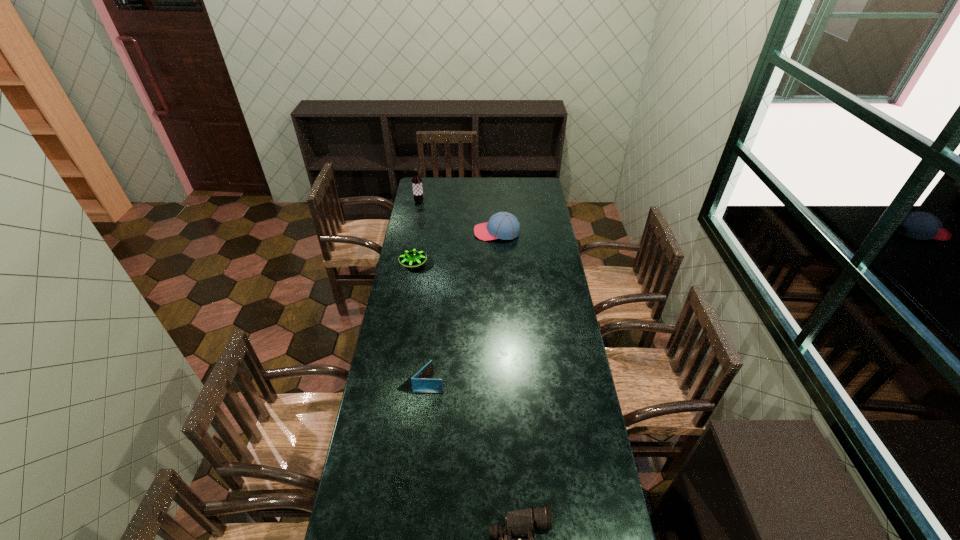
This screenshot has width=960, height=540. In order to click on blank area located 0.320m on the front-facing side of the second farthest object in this screenshot , I will do `click(417, 232)`.

Locate an element on the screen. This screenshot has width=960, height=540. vacant area located on the exterior surface of the third object from left to right is located at coordinates (511, 384).

Image resolution: width=960 pixels, height=540 pixels. Identify the location of vacant region located 0.110m on the front of the saucer. (409, 287).

You are a GUI agent. You are given a task and a screenshot of the screen. Output one action in this format:
    pyautogui.click(x=<x>, y=<y>)
    Task: Click on the root beer present at the left edge
    
    Given the screenshot: What is the action you would take?
    pyautogui.click(x=416, y=180)

Where is `wallet present at the left edge`? wallet present at the left edge is located at coordinates (422, 383).

Identify the location of saucer situated at the left edge. (413, 257).

In the image, there is a desktop. Identify the location of vacant space at the far edge. The image size is (960, 540). (460, 185).

Locate an element on the screen. The height and width of the screenshot is (540, 960). vacant area at the left edge is located at coordinates click(x=396, y=302).

Locate an element on the screen. The height and width of the screenshot is (540, 960). vacant space at the right edge of the desktop is located at coordinates (534, 221).

Where is `vacant space at the far right corner`? This screenshot has height=540, width=960. vacant space at the far right corner is located at coordinates pos(534,188).